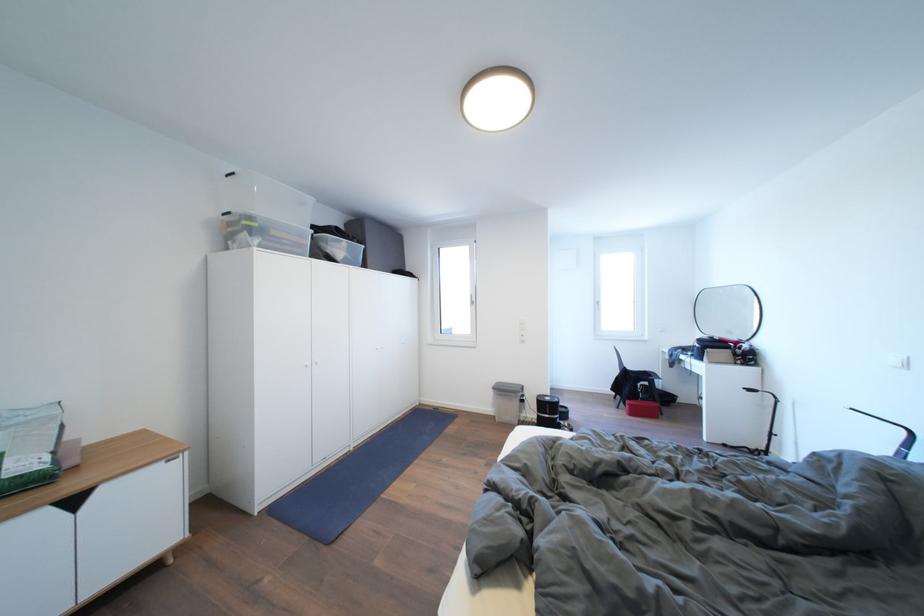
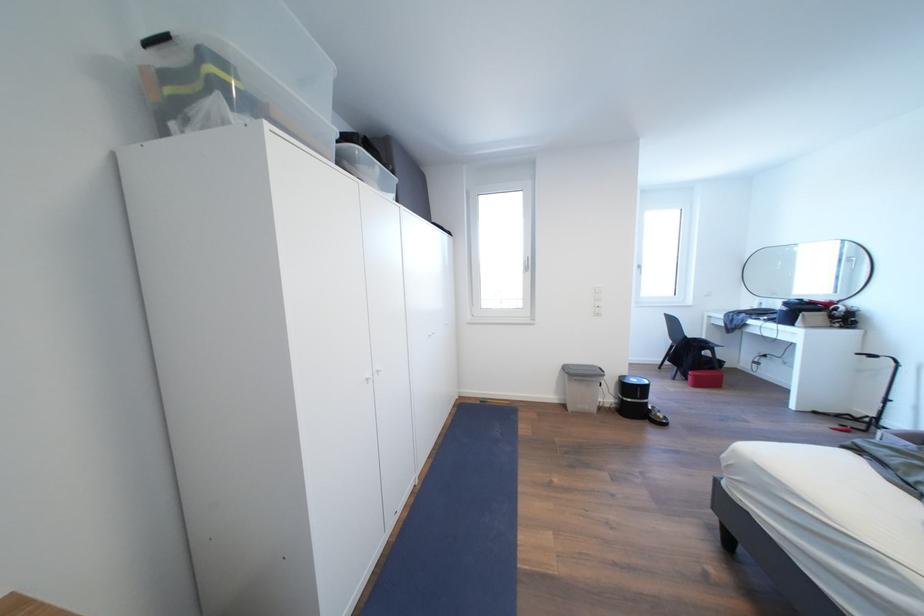
In the second image, find the point that corresponds to (638,410) in the first image.

(703, 381)